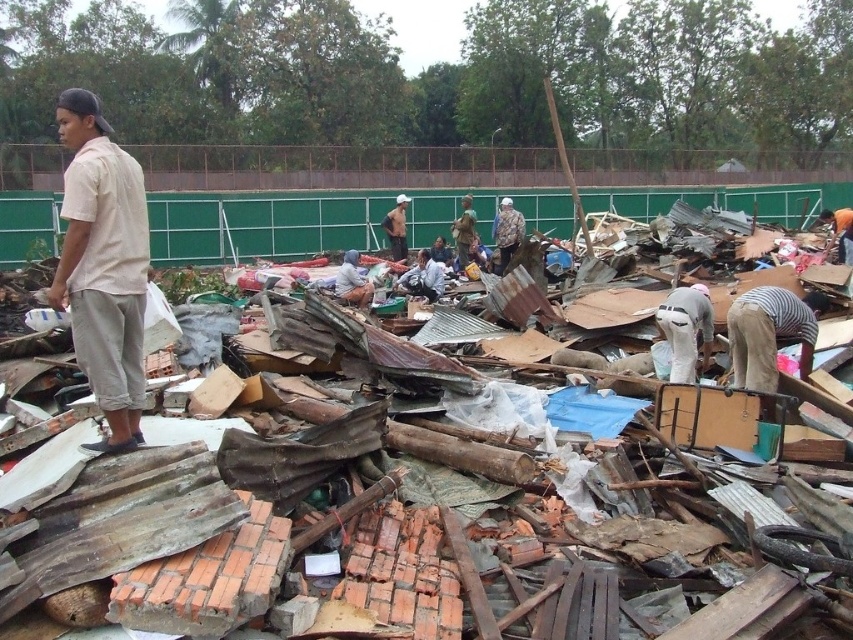
Question: Is white matte shirt at center to the left of camouflage jacket at center from the viewer's perspective?

Choices:
 (A) no
 (B) yes

Answer: (A)

Question: Is striped fabric shirt at right to the right of orange fabric at center from the viewer's perspective?

Choices:
 (A) no
 (B) yes

Answer: (A)

Question: Which object is positioned farthest from the camouflage fabric jacket at center?

Choices:
 (A) striped fabric shirt at right
 (B) brown corrugated metal at left
 (C) white fabric at center

Answer: (A)

Question: Does camouflage jacket at center have a greater width compared to orange fabric at center?

Choices:
 (A) no
 (B) yes

Answer: (A)

Question: Which object is farther from the camera taking this photo?

Choices:
 (A) camouflage jacket at center
 (B) orange fabric at center
 (C) light blue shirt at center
 (D) striped fabric shirt at right

Answer: (A)

Question: Among these points, which one is farthest from the camera?

Choices:
 (A) (398, 196)
 (B) (834, 212)

Answer: (A)